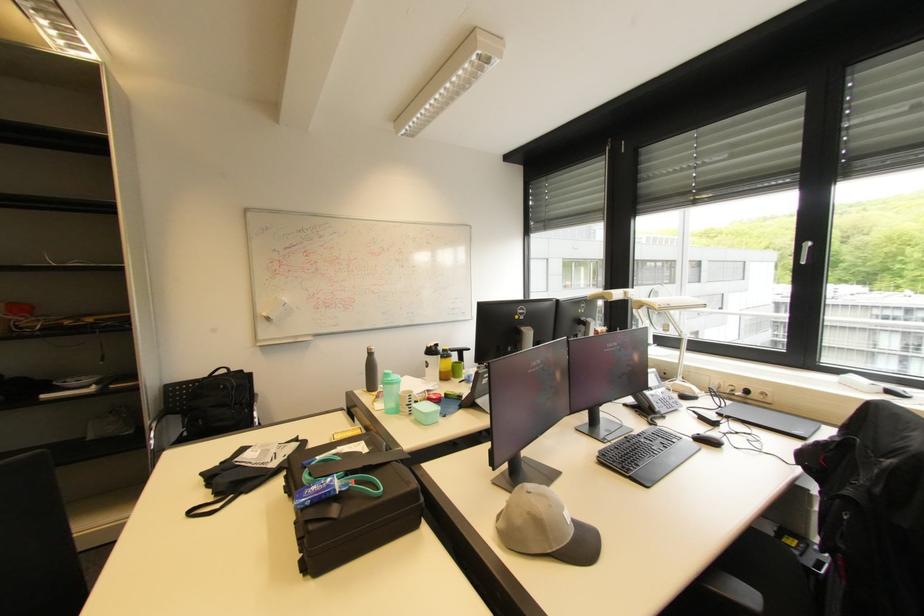
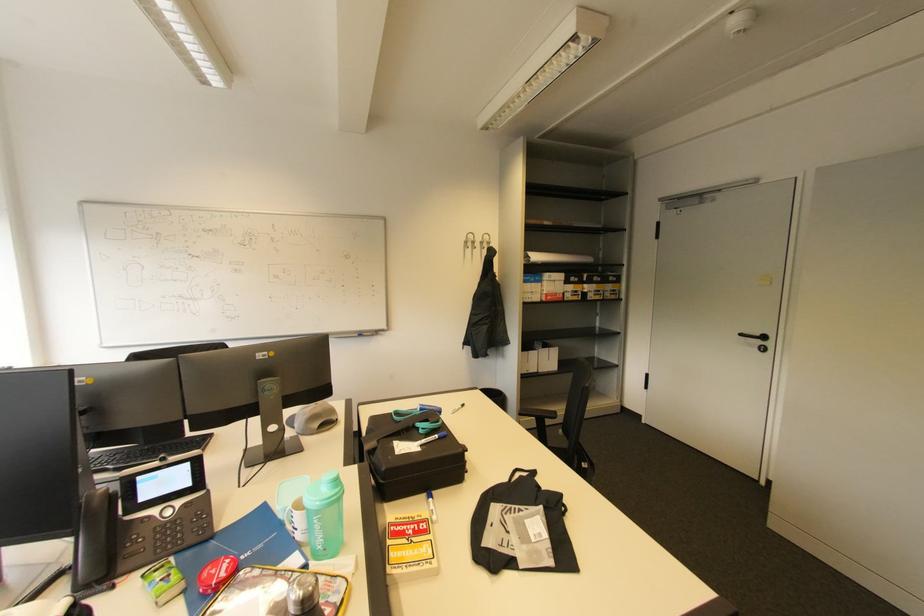
Locate, in the second image, the point that corresponds to [261,458] in the first image.

(531, 523)